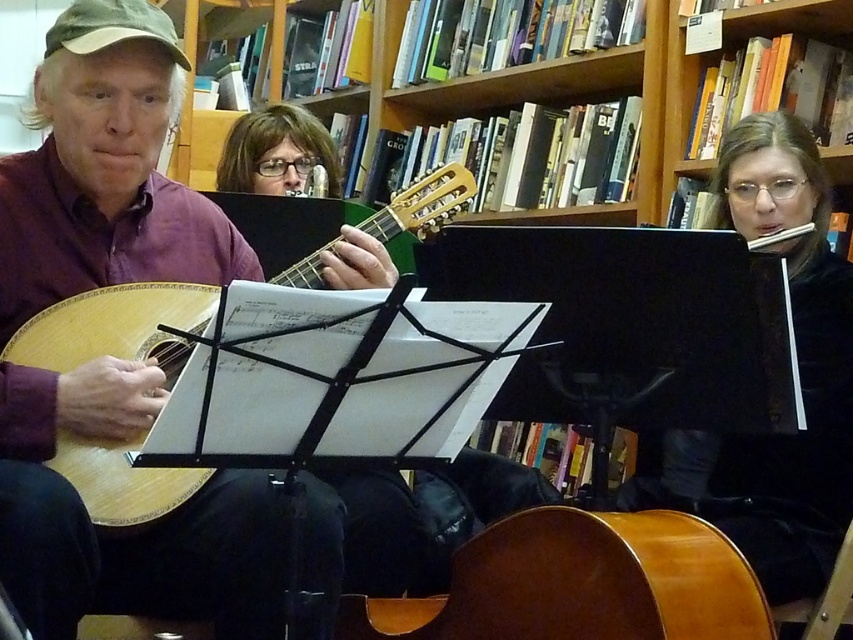
Question: Estimate the real-world distances between objects in this image. Which object is farther from the matte wood guitar at left?

Choices:
 (A) black velvet dress at center
 (B) shiny brown cello at lower center

Answer: (A)

Question: Estimate the real-world distances between objects in this image. Which object is closer to the black velvet dress at center?

Choices:
 (A) shiny brown cello at lower center
 (B) matte wood guitar at left

Answer: (A)

Question: Is black velvet dress at center above shiny brown cello at lower center?

Choices:
 (A) yes
 (B) no

Answer: (A)

Question: Which object is farther from the camera taking this photo?

Choices:
 (A) matte wood guitar at left
 (B) black velvet dress at center

Answer: (B)

Question: Does matte wood guitar at left have a greater width compared to black velvet dress at center?

Choices:
 (A) yes
 (B) no

Answer: (A)

Question: Is matte wood guitar at left wider than black velvet dress at center?

Choices:
 (A) yes
 (B) no

Answer: (A)